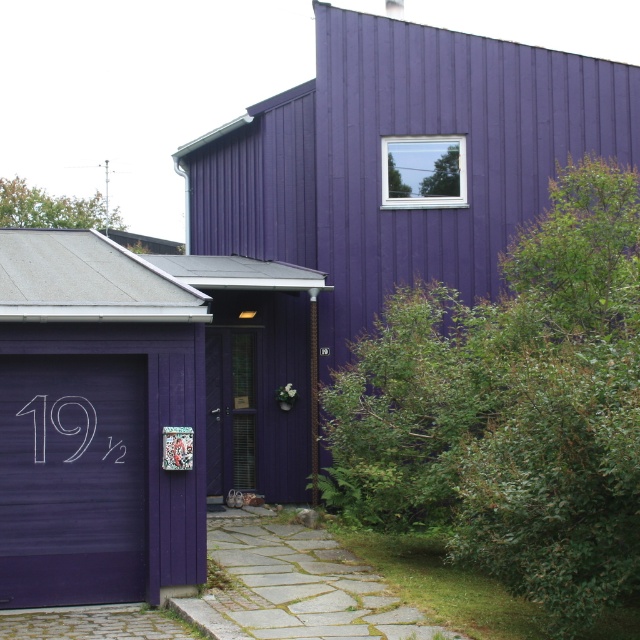
Does point (221, 394) lie behind point (77, 428)?

Yes, point (221, 394) is farther from viewer.

Between point (244, 481) and point (92, 428), which one is positioned in front?

Point (92, 428) is more forward.

Does point (237, 385) lie in front of point (72, 396)?

No, (237, 385) is behind (72, 396).

Where is `matte purple door at center`? The height and width of the screenshot is (640, 640). matte purple door at center is located at coordinates (230, 410).

Which is in front, point (0, 422) or point (44, 433)?

Point (0, 422)

Which is above, matte purple garage door at left or white chalk-like at lower left?

white chalk-like at lower left

Describe the element at coordinates (72, 477) in the screenshot. I see `matte purple garage door at left` at that location.

Find the location of a particular element. matte purple garage door at left is located at coordinates (72, 477).

Measure the distance between purple woodshed at left and camera.

purple woodshed at left and camera are 17.30 meters apart.

How much distance is there between purple woodshed at left and matte purple garage door at left?

5.48 meters

Is point (294, 356) less distant than point (93, 417)?

No, it is behind (93, 417).

This screenshot has width=640, height=640. I want to click on purple woodshed at left, so click(401, 161).